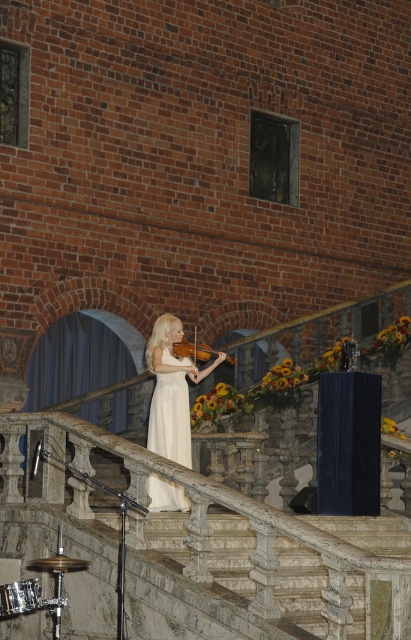
Can you confirm if white satin dress at center is thinner than wooden violin at center?

In fact, white satin dress at center might be wider than wooden violin at center.

Can you confirm if white satin dress at center is bigger than wooden violin at center?

Yes.

Where is `white satin dress at center`? Image resolution: width=411 pixels, height=640 pixels. white satin dress at center is located at coordinates (170, 412).

Is white silk dress at center taller than shiny silver drum at lower left?

Indeed, white silk dress at center has a greater height compared to shiny silver drum at lower left.

Who is shorter, white silk dress at center or shiny silver drum at lower left?

With less height is shiny silver drum at lower left.

What do you see at coordinates (170, 392) in the screenshot? This screenshot has height=640, width=411. I see `white silk dress at center` at bounding box center [170, 392].

This screenshot has width=411, height=640. I want to click on white silk dress at center, so pyautogui.click(x=170, y=392).

How far apart are white satin dress at center and shiny silver drum at lower left?

white satin dress at center and shiny silver drum at lower left are 3.76 meters apart.

Between white satin dress at center and shiny silver drum at lower left, which one is positioned lower?

shiny silver drum at lower left is below.

What do you see at coordinates (170, 412) in the screenshot? I see `white satin dress at center` at bounding box center [170, 412].

The width and height of the screenshot is (411, 640). In order to click on white satin dress at center in this screenshot , I will do `click(170, 412)`.